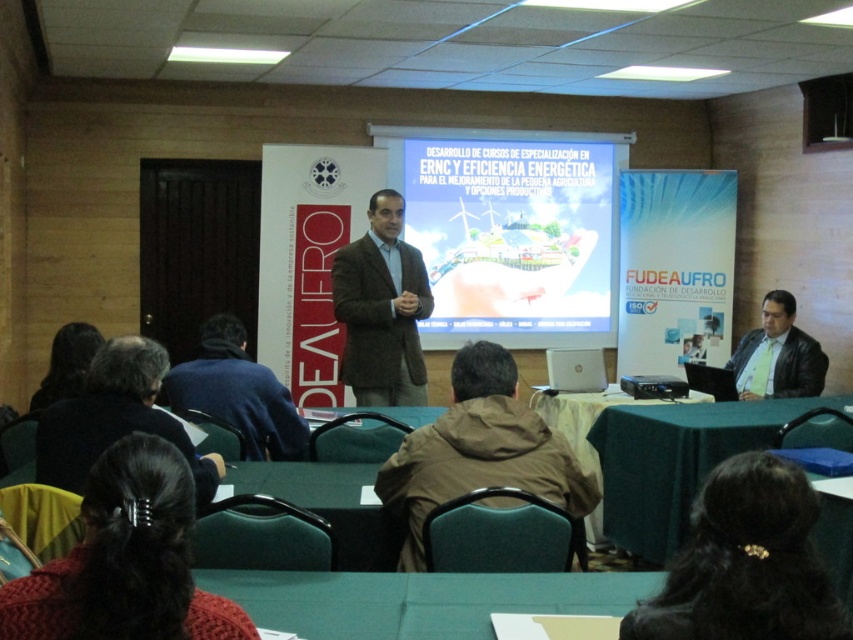
What do you see at coordinates (381, 308) in the screenshot?
I see `brown woolen suit at center` at bounding box center [381, 308].

Does brown woolen suit at center appear on the right side of dark brown hair at lower left?

Yes, brown woolen suit at center is to the right of dark brown hair at lower left.

Identify the location of brown woolen suit at center. Image resolution: width=853 pixels, height=640 pixels. (381, 308).

Can you confirm if brown woolen suit at center is shorter than leather jacket at lower right?

No, brown woolen suit at center is not shorter than leather jacket at lower right.

Is point (403, 403) closer to camera compared to point (811, 376)?

Yes, point (403, 403) is in front of point (811, 376).

The width and height of the screenshot is (853, 640). Identify the location of brown woolen suit at center. (381, 308).

Is point (546, 208) positioned behind point (534, 483)?

Yes, it is behind point (534, 483).

Can you confirm if matte white projector screen at center is positioned to the left of brown fabric jacket at center?

Incorrect, matte white projector screen at center is not on the left side of brown fabric jacket at center.

Where is `matte white projector screen at center`? matte white projector screen at center is located at coordinates (512, 236).